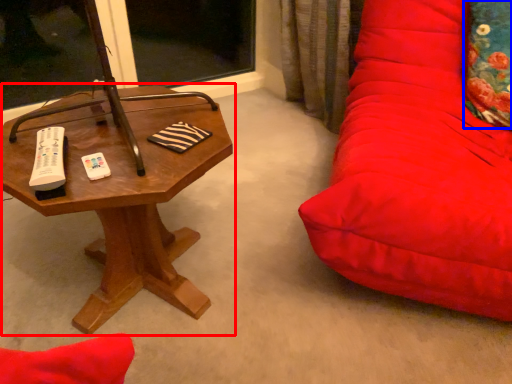
Question: Which point is further to the camera, table (highlighted by a red box) or throw pillow (highlighted by a blue box)?

Choices:
 (A) table
 (B) throw pillow

Answer: (B)